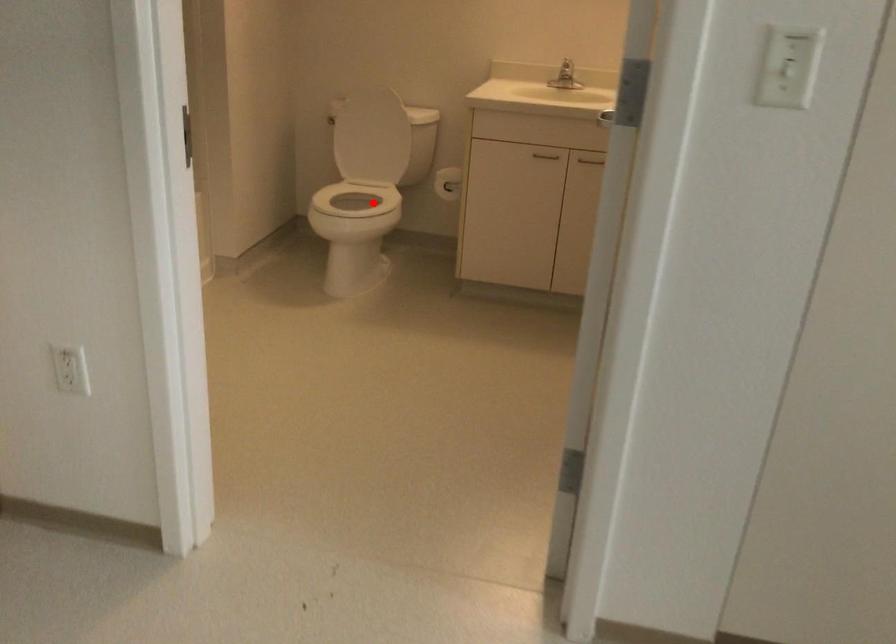
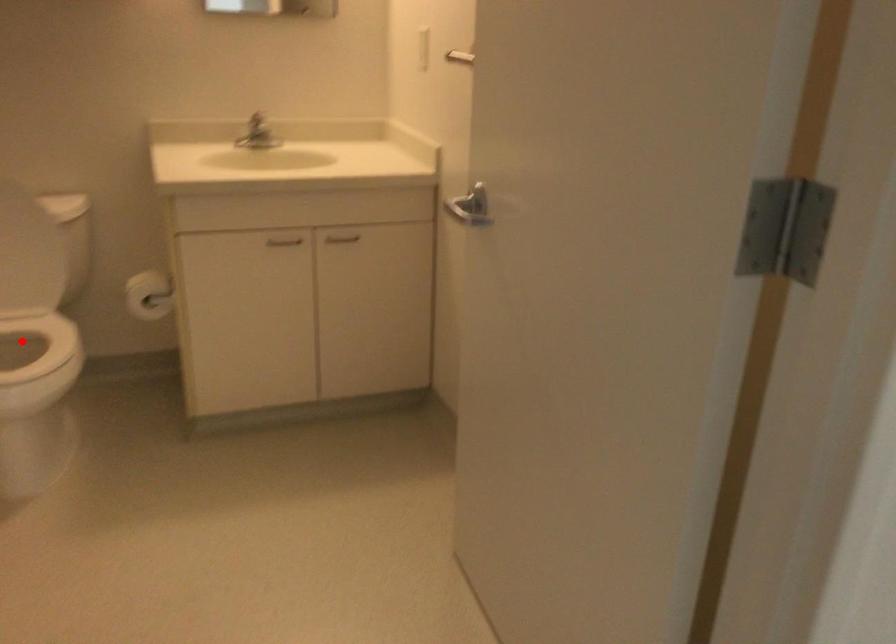
I am providing you with two images of the same scene from different viewpoints. A red point is marked on the first image and another point is marked on the second image. Is the marked point in image1 the same physical position as the marked point in image2?

Yes